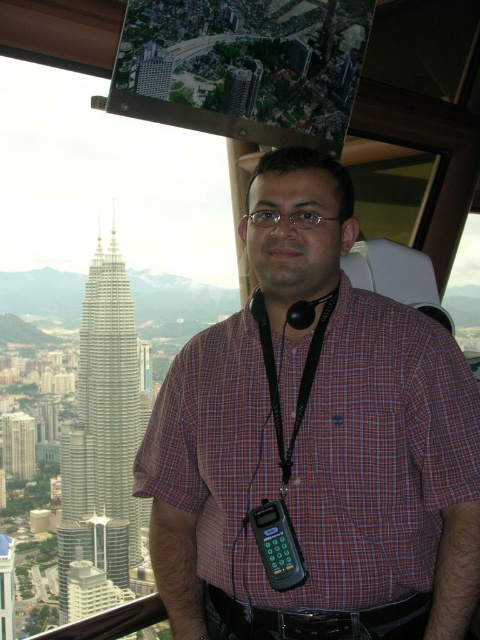
You are a visitor at the observation deck and notice the black plastic phone at center and the green glass building at left. Which object is taller from your vantage point?

The black plastic phone at center is taller than the green glass building at left.

You are a visitor at the observation deck and notice the black fabric lanyard at center and the green glass building at left. Which object is larger in size?

The black fabric lanyard at center is bigger than the green glass building at left.